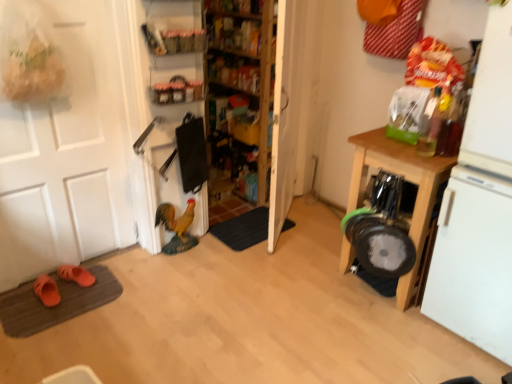
Locate an element on the screen. The width and height of the screenshot is (512, 384). blank space situated above matte plastic shelf at upper center, which is counted as the 3th shelf, starting from the back (from a real-world perspective) is located at coordinates (173, 18).